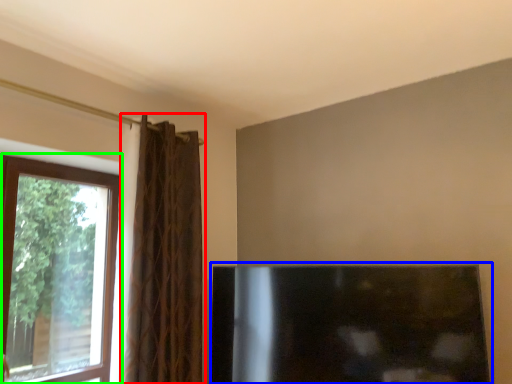
Question: Based on their relative distances, which object is nearer to curtain (highlighted by a red box)? Choose from fireplace (highlighted by a blue box) and window (highlighted by a green box).

Choices:
 (A) fireplace
 (B) window

Answer: (B)